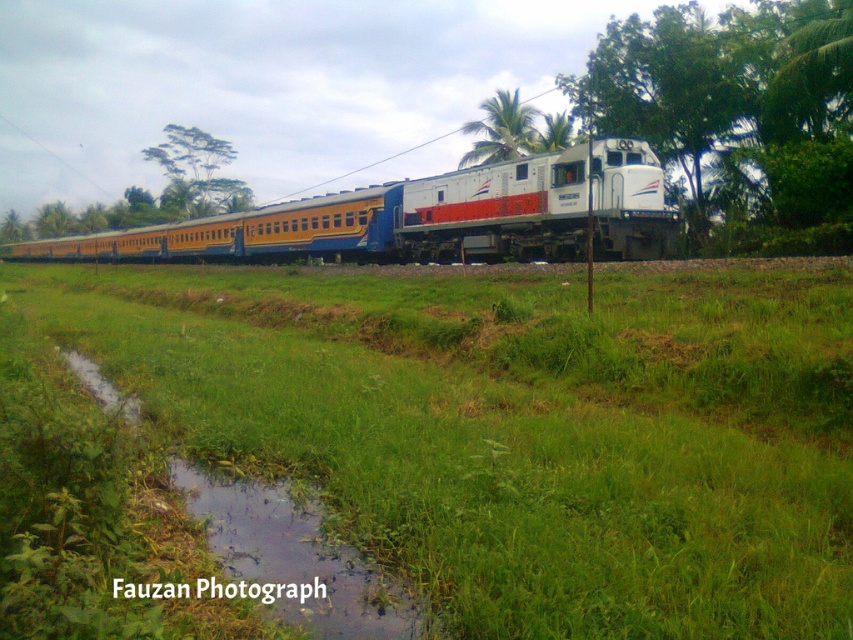
Question: Where is green grassy at center located in relation to green leafy tree at upper center in the image?

Choices:
 (A) right
 (B) left

Answer: (A)

Question: Which object is positioned closest to the green grassy puddle at lower center?

Choices:
 (A) yellow matte train at center
 (B) green leafy palm at upper center

Answer: (A)

Question: In this image, where is green grassy at center located relative to green leafy tree at center?

Choices:
 (A) above
 (B) below

Answer: (B)

Question: Can you confirm if green grassy at center is smaller than yellow matte train at center?

Choices:
 (A) no
 (B) yes

Answer: (B)

Question: Which object appears farthest from the camera in this image?

Choices:
 (A) green leafy tree at center
 (B) green grassy at center
 (C) green leafy palm at upper center

Answer: (C)

Question: Which object is closer to the camera taking this photo?

Choices:
 (A) green leafy palm at upper center
 (B) green leafy tree at upper center
 (C) green grassy at center
 (D) green grassy puddle at lower center

Answer: (C)